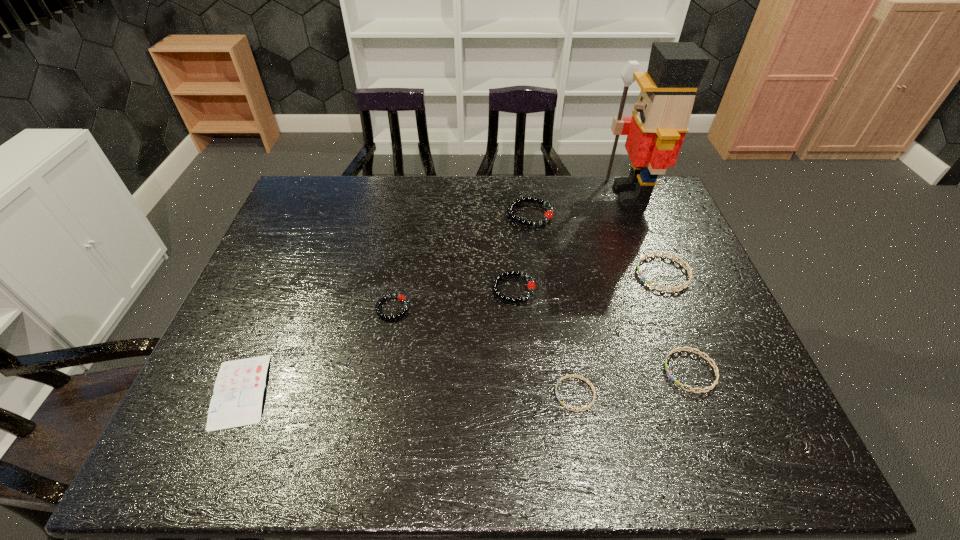
This screenshot has height=540, width=960. In order to click on nutcracker in this screenshot , I will do `click(655, 132)`.

This screenshot has height=540, width=960. What are the coordinates of `red nutcracker` in the screenshot? It's located at (655, 132).

Where is `the farthest bracelet`? This screenshot has width=960, height=540. the farthest bracelet is located at coordinates (548, 215).

Locate an element on the screen. The width and height of the screenshot is (960, 540). the farthest black bracelet is located at coordinates (548, 215).

Locate an element on the screen. This screenshot has height=540, width=960. the biggest blue bracelet is located at coordinates (682, 262).

Where is `the second smallest black bracelet`? This screenshot has height=540, width=960. the second smallest black bracelet is located at coordinates (531, 286).

At what (x,y) coordinates should I click in order to perform the action: click on the second smallest blue bracelet. Please return your answer as a coordinate pair (x, y). This screenshot has height=540, width=960. Looking at the image, I should click on (714, 366).

At what (x,y) coordinates should I click in order to perform the action: click on the leftmost bracelet. Please return your answer as a coordinate pair (x, y). The width and height of the screenshot is (960, 540). Looking at the image, I should click on (402, 298).

What are the coordinates of `the seventh object from right to left` in the screenshot? It's located at (402, 298).

Find the location of a particular element. This screenshot has width=960, height=540. the leftmost blue bracelet is located at coordinates (576, 376).